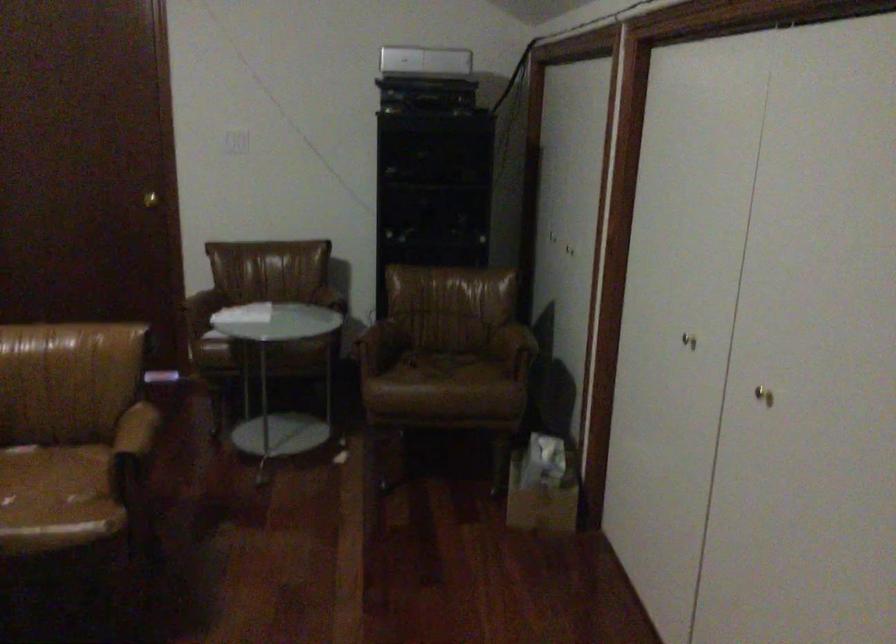
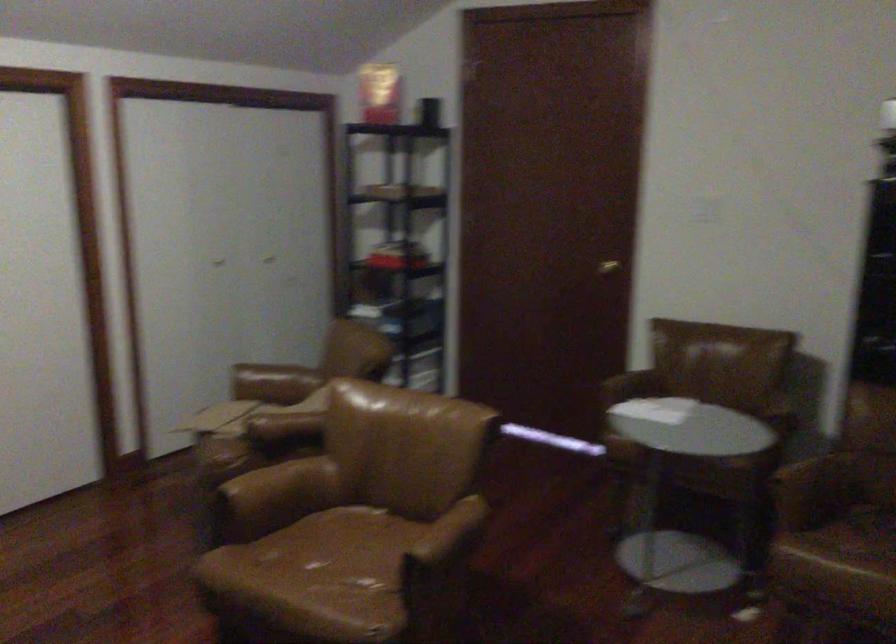
Where in the second image is the point corresponding to [141,431] from the first image?

(448, 536)